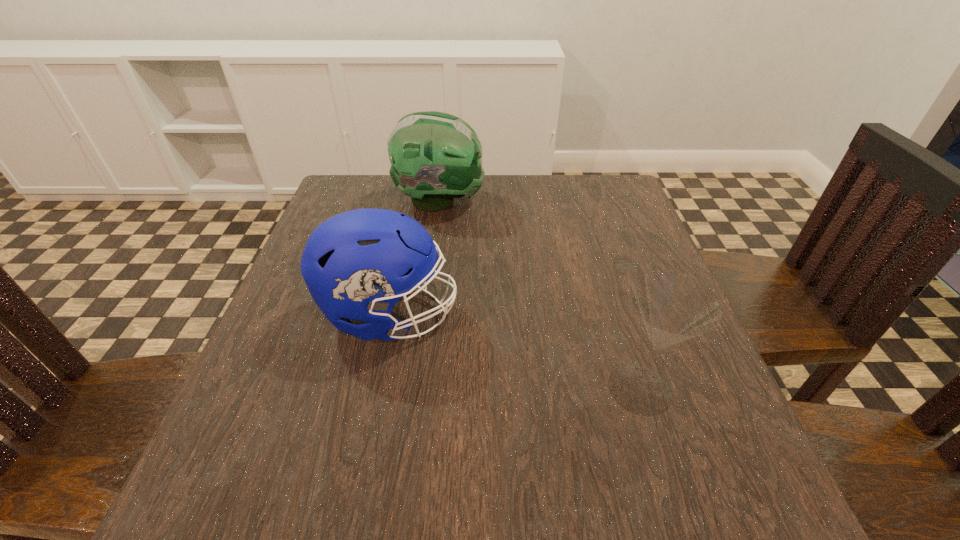
At what (x,y) coordinates should I click in order to perform the action: click on free space that satisfies the following two spatial constraints: 1. on the back side of the flute glass; 2. on the front-facing side of the second nearest object. Please return your answer as a coordinate pair (x, y). This screenshot has height=540, width=960. Looking at the image, I should click on (616, 314).

Locate an element on the screen. This screenshot has width=960, height=540. vacant area in the image that satisfies the following two spatial constraints: 1. on the visor of the rightmost object; 2. on the right side of the farthest object is located at coordinates (417, 388).

At what (x,y) coordinates should I click in order to perform the action: click on vacant point that satisfies the following two spatial constraints: 1. on the visor of the farther football helmet; 2. on the back side of the rightmost object. Please return your answer as a coordinate pair (x, y). The width and height of the screenshot is (960, 540). Looking at the image, I should click on (417, 388).

This screenshot has height=540, width=960. I want to click on free space that satisfies the following two spatial constraints: 1. on the front-facing side of the second nearest object; 2. on the back side of the flute glass, so click(374, 388).

Where is `free space that satisfies the following two spatial constraints: 1. on the visor of the flute glass; 2. on the right side of the farthest object`? The width and height of the screenshot is (960, 540). free space that satisfies the following two spatial constraints: 1. on the visor of the flute glass; 2. on the right side of the farthest object is located at coordinates click(x=417, y=388).

What are the coordinates of `free space that satisfies the following two spatial constraints: 1. on the visor of the nearest object; 2. on the right side of the farther football helmet` in the screenshot? It's located at (417, 388).

Locate an element on the screen. The image size is (960, 540). vacant space that satisfies the following two spatial constraints: 1. on the visor of the nearest object; 2. on the right side of the farthest object is located at coordinates (417, 388).